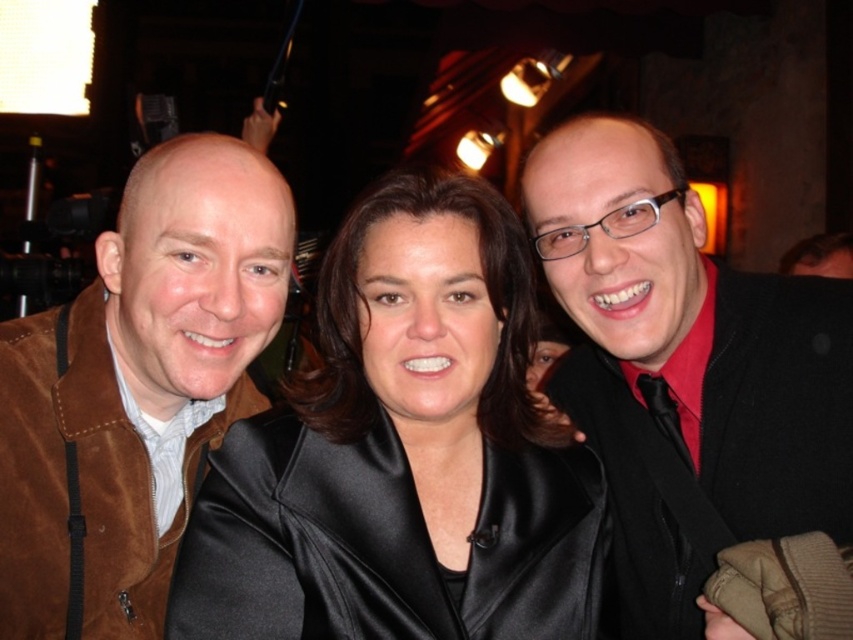
Can you confirm if satin black jacket at center is positioned below suede jacket at left?

Correct, satin black jacket at center is located below suede jacket at left.

Does satin black jacket at center have a lesser width compared to suede jacket at left?

In fact, satin black jacket at center might be wider than suede jacket at left.

This screenshot has height=640, width=853. I want to click on satin black jacket at center, so click(x=403, y=452).

Identify the location of satin black jacket at center. The height and width of the screenshot is (640, 853). (403, 452).

Which is more to the left, satin black jacket at center or black matte jacket at center?

satin black jacket at center

Between satin black jacket at center and black matte jacket at center, which one appears on the right side from the viewer's perspective?

black matte jacket at center

Which is in front, point (474, 520) or point (764, 401)?

Point (474, 520) is more forward.

The image size is (853, 640). Identify the location of satin black jacket at center. (403, 452).

Does black matte jacket at center have a greater height compared to suede jacket at left?

Indeed, black matte jacket at center has a greater height compared to suede jacket at left.

What do you see at coordinates (686, 372) in the screenshot? The image size is (853, 640). I see `black matte jacket at center` at bounding box center [686, 372].

Describe the element at coordinates (686, 372) in the screenshot. I see `black matte jacket at center` at that location.

Where is `black matte jacket at center`? black matte jacket at center is located at coordinates (686, 372).